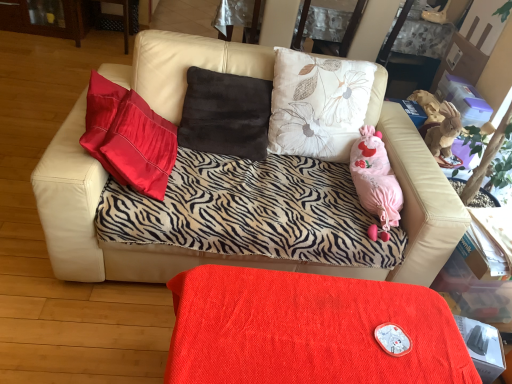
Question: From the image's perspective, is velvet red table at lower center over zebra-patterned fabric couch at center?

Choices:
 (A) yes
 (B) no

Answer: (B)

Question: Would you say velvet red table at lower center is a long distance from zebra-patterned fabric couch at center?

Choices:
 (A) no
 (B) yes

Answer: (A)

Question: Is velvet red table at lower center in contact with zebra-patterned fabric couch at center?

Choices:
 (A) yes
 (B) no

Answer: (B)

Question: Can you confirm if velvet red table at lower center is positioned to the right of zebra-patterned fabric couch at center?

Choices:
 (A) no
 (B) yes

Answer: (B)

Question: Is the depth of velvet red table at lower center less than that of zebra-patterned fabric couch at center?

Choices:
 (A) no
 (B) yes

Answer: (B)

Question: From the image's perspective, would you say velvet red table at lower center is shown under zebra-patterned fabric couch at center?

Choices:
 (A) no
 (B) yes

Answer: (B)

Question: Is zebra-patterned fabric couch at center in contact with velvet red table at lower center?

Choices:
 (A) no
 (B) yes

Answer: (A)

Question: Does zebra-patterned fabric couch at center have a lesser height compared to velvet red table at lower center?

Choices:
 (A) yes
 (B) no

Answer: (B)

Question: Is velvet red table at lower center surrounded by zebra-patterned fabric couch at center?

Choices:
 (A) no
 (B) yes

Answer: (A)

Question: Can you confirm if zebra-patterned fabric couch at center is positioned to the right of velvet red table at lower center?

Choices:
 (A) yes
 (B) no

Answer: (B)

Question: Does zebra-patterned fabric couch at center have a lesser width compared to velvet red table at lower center?

Choices:
 (A) yes
 (B) no

Answer: (B)

Question: From the image's perspective, is zebra-patterned fabric couch at center above velvet red table at lower center?

Choices:
 (A) no
 (B) yes

Answer: (B)

Question: Is velvet red table at lower center wider or thinner than zebra-patterned fabric couch at center?

Choices:
 (A) wide
 (B) thin

Answer: (B)